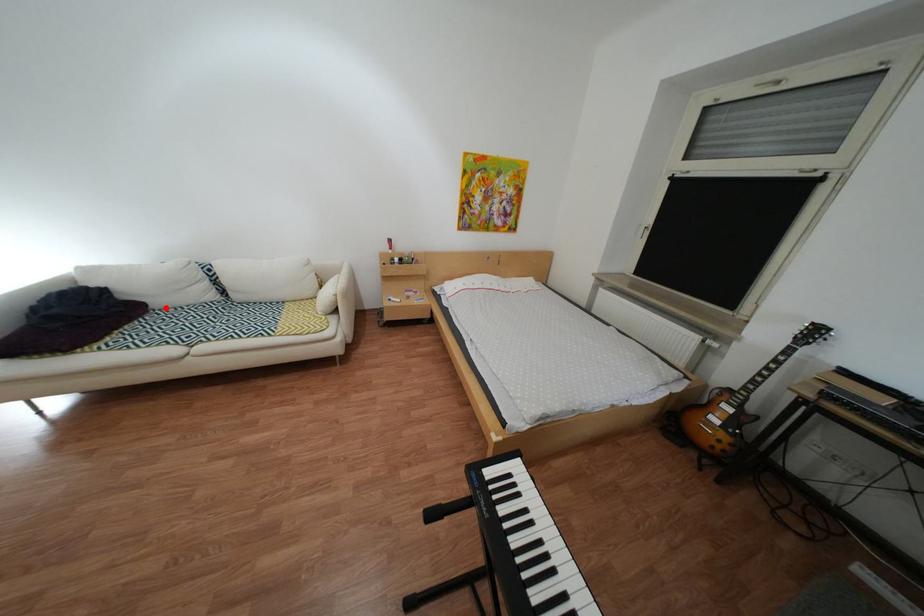
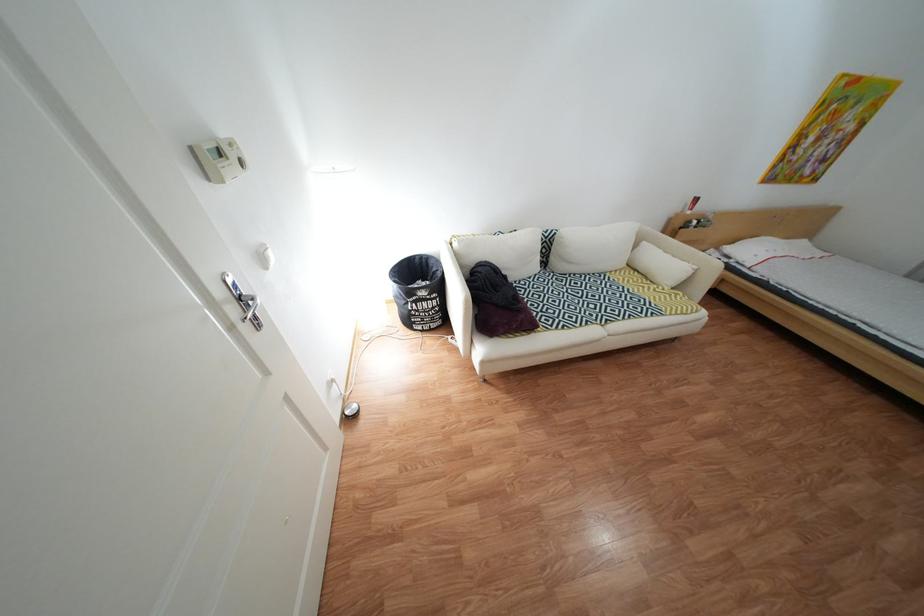
The point at the highlighted location is marked in the first image. Where is the corresponding point in the second image?

(525, 281)